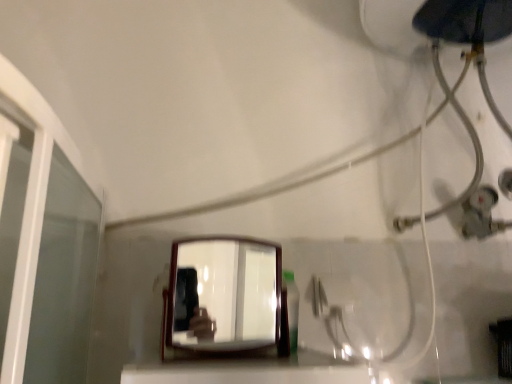
Describe the element at coordinates (224, 294) in the screenshot. I see `wooden-framed mirror at center` at that location.

Find the location of a particular element. The image size is (512, 384). wooden-framed mirror at center is located at coordinates (224, 294).

What is the approximate height of wooden-framed mirror at center?

wooden-framed mirror at center is 7.16 inches in height.

The height and width of the screenshot is (384, 512). I want to click on wooden-framed mirror at center, so click(x=224, y=294).